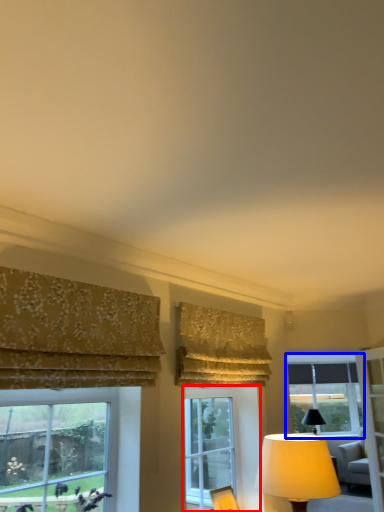
Question: Which object appears farthest to the camera in this image, window (highlighted by a red box) or window (highlighted by a blue box)?

Choices:
 (A) window
 (B) window

Answer: (B)